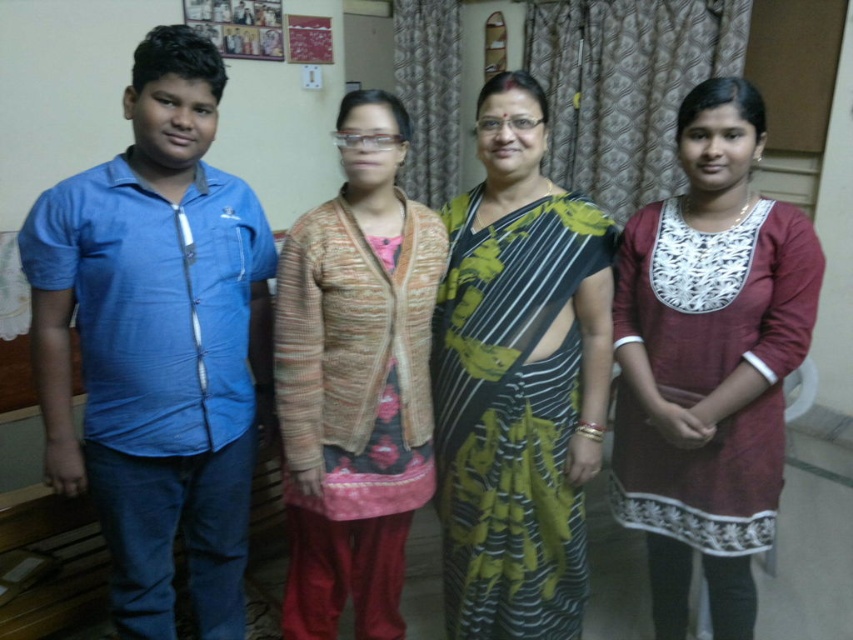
Question: Is black and green striped saree at center bigger than knitted sweater at center?

Choices:
 (A) no
 (B) yes

Answer: (A)

Question: Among these objects, which one is nearest to the camera?

Choices:
 (A) maroon cotton kurta at right
 (B) knitted sweater at center
 (C) blue cotton shirt at left

Answer: (C)

Question: Where is blue cotton shirt at left located in relation to black and green striped saree at center in the image?

Choices:
 (A) left
 (B) right

Answer: (A)

Question: Which of these objects is positioned closest to the knitted sweater at center?

Choices:
 (A) black and green striped saree at center
 (B) maroon cotton kurta at right

Answer: (A)

Question: Is blue cotton shirt at left smaller than black and green striped saree at center?

Choices:
 (A) yes
 (B) no

Answer: (B)

Question: Which point appears farthest from the camera in this image?

Choices:
 (A) (206, 236)
 (B) (723, 628)

Answer: (B)